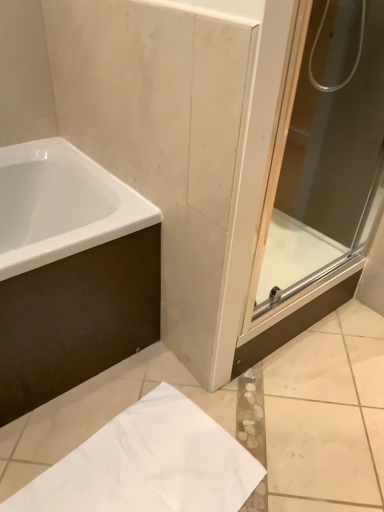
Question: Is point (344, 31) positioned closer to the camera than point (112, 281)?

Choices:
 (A) farther
 (B) closer

Answer: (A)

Question: Considering their positions, is transparent glass shower door at right located in front of or behind white glossy bathtub at upper left?

Choices:
 (A) front
 (B) behind

Answer: (A)

Question: Based on their relative distances, which object is nearer to the white matte paper at lower center?

Choices:
 (A) white glossy bathtub at upper left
 (B) transparent glass shower door at right

Answer: (A)

Question: Which is nearer to the white matte paper at lower center?

Choices:
 (A) white glossy bathtub at upper left
 (B) transparent glass shower door at right

Answer: (A)